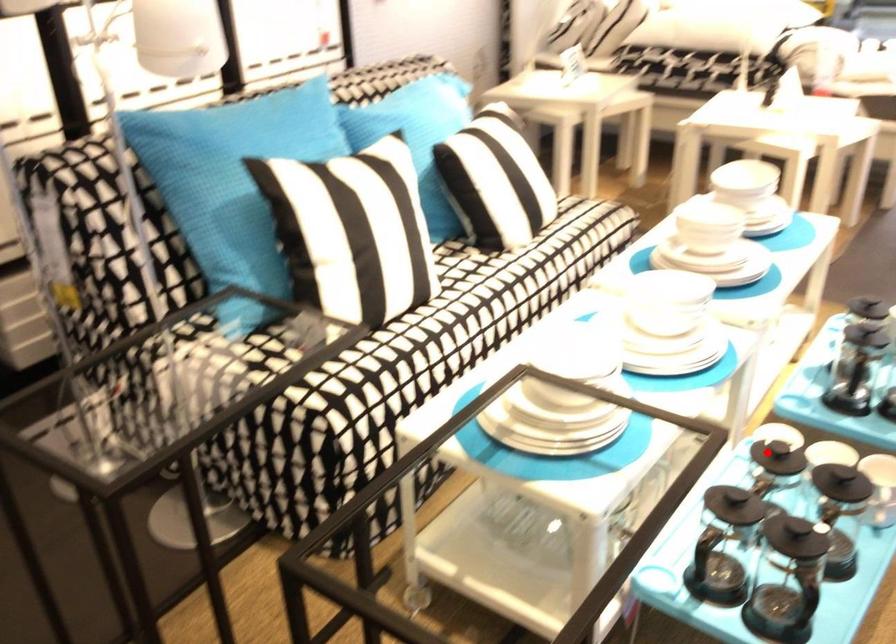
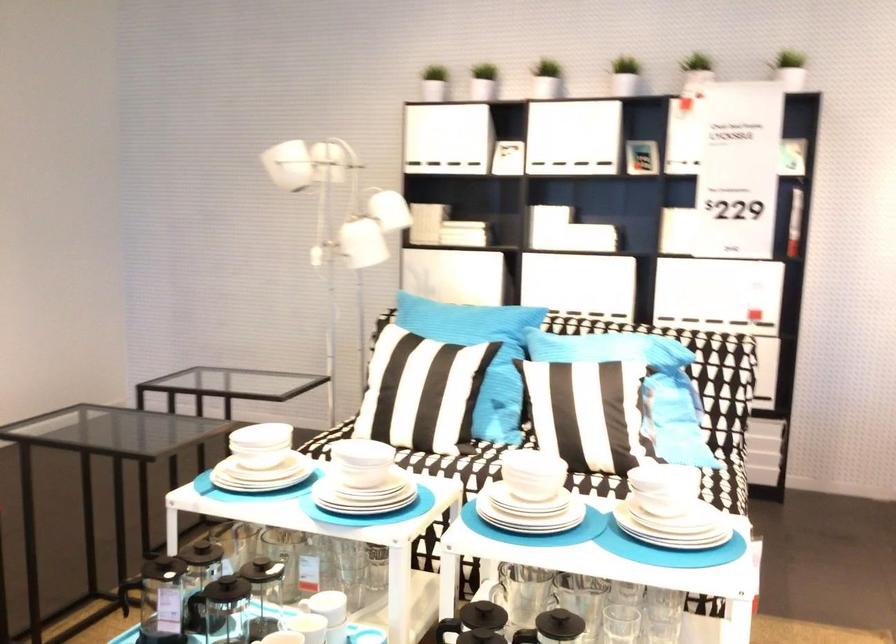
Question: I am providing you with two images of the same scene from different viewpoints. Given a red point in image1, look at the same physical point in image2. Is it:

Choices:
 (A) Closer to the viewpoint
 (B) Farther from the viewpoint

Answer: (B)